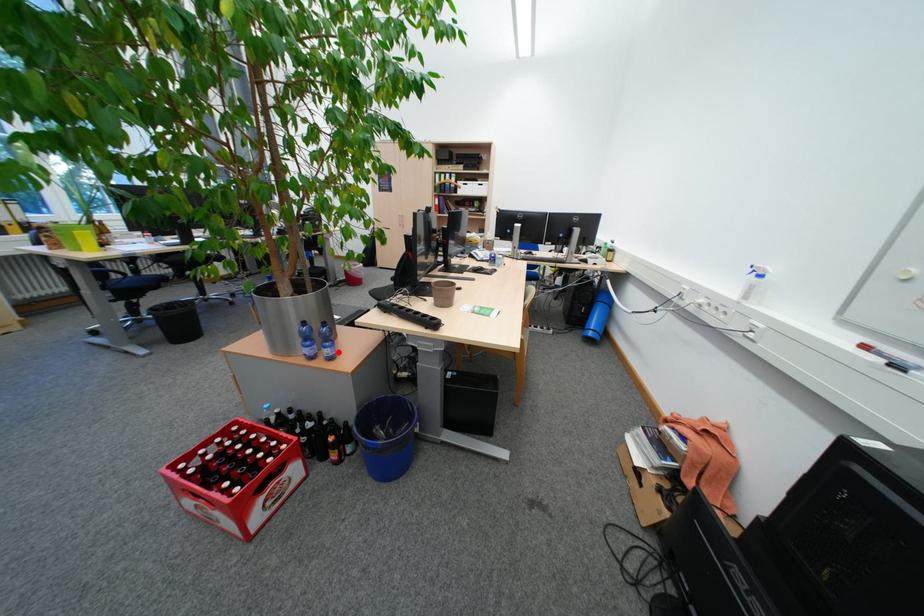
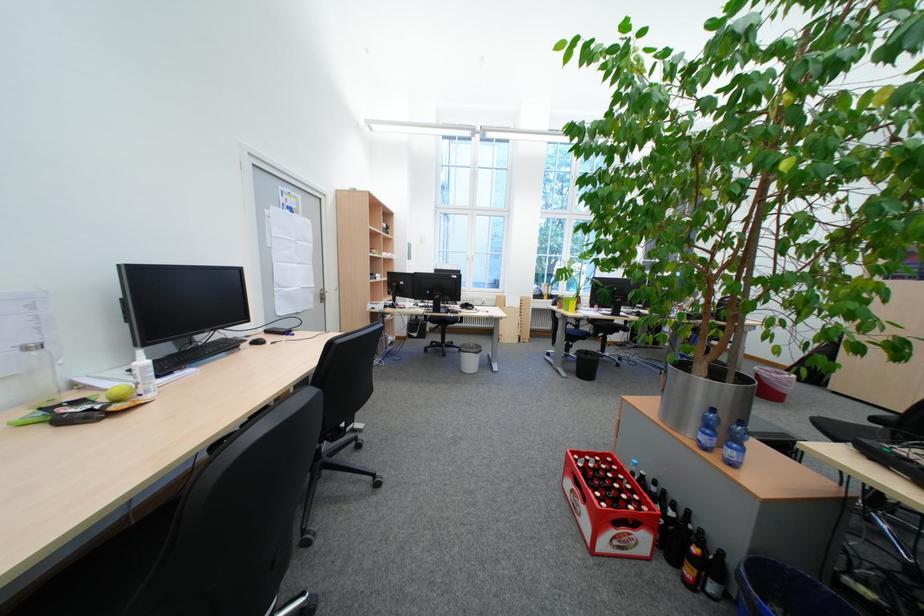
Question: I am providing you with two images of the same scene from different viewpoints. A red point is marked on the first image. Can you still see the location of the red point in image 2?

Choices:
 (A) Yes
 (B) No

Answer: (A)